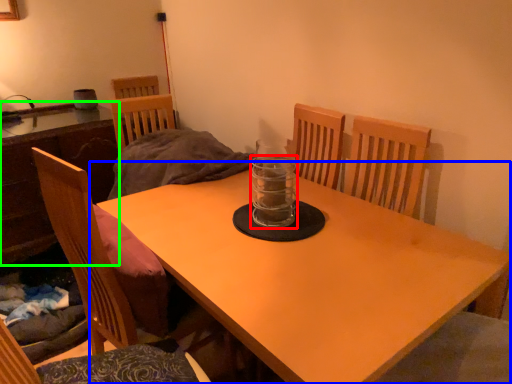
Question: Based on their relative distances, which object is nearer to glass jar (highlighted by a red box)? Choose from table (highlighted by a blue box) and table (highlighted by a green box).

Choices:
 (A) table
 (B) table

Answer: (A)